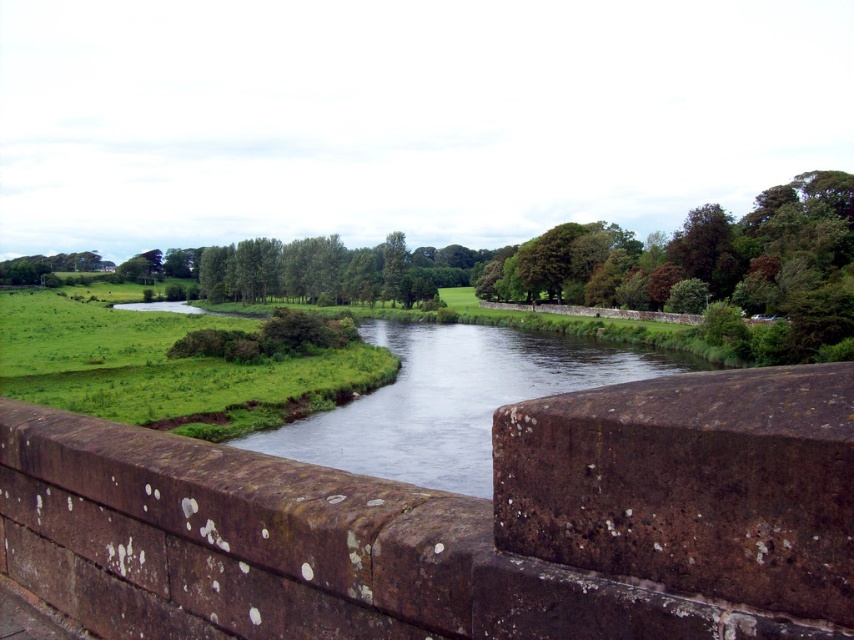
You are a hiker standing on the brown stone ledge at center. You want to cross to the other side of the clear water at center. Can you step directly across the ledge to reach the opposite bank without getting wet?

The brown stone ledge at center has a lesser width compared to clear water at center, so the water is wider than the ledge. Therefore, stepping directly across the ledge won not reach the opposite bank, and you would get wet.

You are a hiker who wants to cross the river at the center of the scene. You have a small backpack with you. The brown stone ledge at center and the clear water at center are in your path. Considering their sizes, which one would you choose to step on to avoid getting your shoes wet?

The brown stone ledge at center has a smaller size compared to clear water at center, so stepping on the brown stone ledge at center is safer to avoid getting your shoes wet since it is less submerged in the clear water at center.